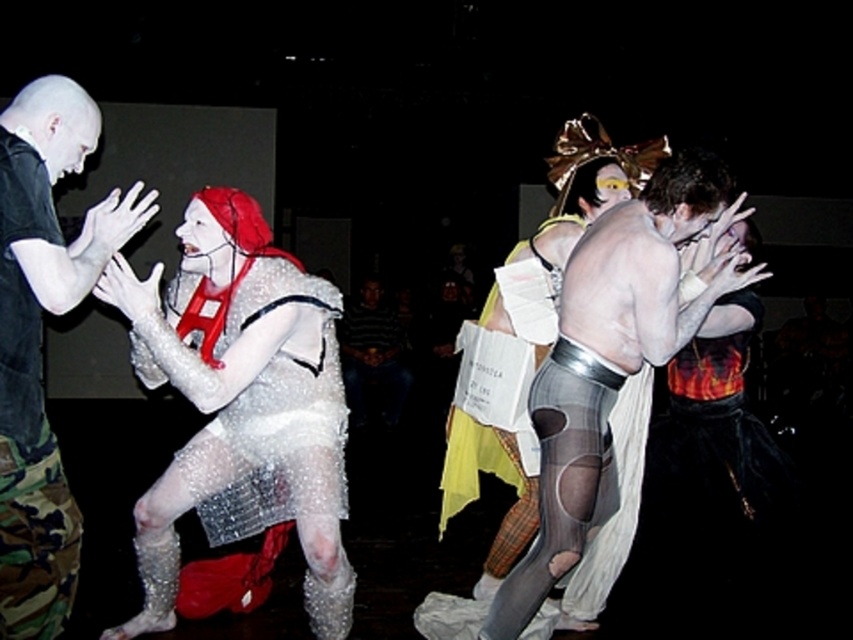
Is white matte paint at left thinner than camo fabric pants at left?

Incorrect, white matte paint at left's width is not less than camo fabric pants at left's.

Does point (22, 474) come farther from viewer compared to point (15, 294)?

That is True.

Which is behind, point (16, 376) or point (71, 557)?

The point (71, 557) is more distant.

Locate an element on the screen. The image size is (853, 640). white matte paint at left is located at coordinates (41, 339).

Is point (286, 340) less distant than point (74, 544)?

No, (286, 340) is behind (74, 544).

Can you confirm if sparkly silver dress at center is positioned to the left of camo fabric pants at left?

No, sparkly silver dress at center is not to the left of camo fabric pants at left.

Image resolution: width=853 pixels, height=640 pixels. Identify the location of sparkly silver dress at center. (241, 403).

Who is positioned more to the right, sparkly silver dress at center or white matte paint at left?

sparkly silver dress at center is more to the right.

Is sparkly silver dress at center wider than white matte paint at left?

Indeed, sparkly silver dress at center has a greater width compared to white matte paint at left.

Describe the element at coordinates (241, 403) in the screenshot. I see `sparkly silver dress at center` at that location.

This screenshot has width=853, height=640. I want to click on sparkly silver dress at center, so click(x=241, y=403).